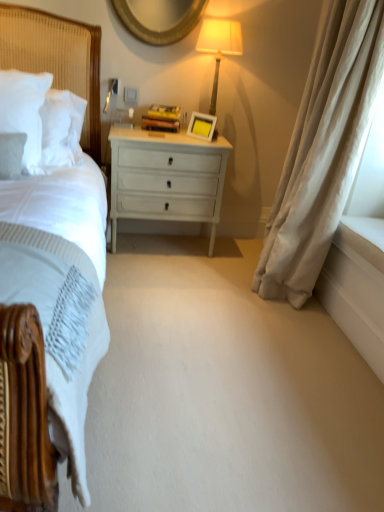
This screenshot has width=384, height=512. What do you see at coordinates (166, 178) in the screenshot?
I see `white glossy drawer at center` at bounding box center [166, 178].

What is the approximate height of yellow matte picture frame at center?

The height of yellow matte picture frame at center is 5.76 inches.

In order to face matte cream lampshade at upper right, should I rotate leftwards or rightwards?

You should look right and rotate roughly 3.415 degrees.

Locate an element on the screen. Image resolution: width=384 pixels, height=512 pixels. white textured headboard at left is located at coordinates (57, 59).

Is gold textured mirror at upper center beside yellow matte picture frame at center?

No, gold textured mirror at upper center is not next to yellow matte picture frame at center.

Which is behind, gold textured mirror at upper center or yellow matte picture frame at center?

yellow matte picture frame at center.

Considering the sizes of objects gold textured mirror at upper center and yellow matte picture frame at center in the image provided, who is wider, gold textured mirror at upper center or yellow matte picture frame at center?

gold textured mirror at upper center.

From a real-world perspective, which is physically above, gold textured mirror at upper center or yellow matte picture frame at center?

From a 3D spatial view, gold textured mirror at upper center is above.

Is white textured headboard at left at the left side of beige velvet curtain at right?

Correct, you'll find white textured headboard at left to the left of beige velvet curtain at right.

From the picture: Which object is more forward, white textured headboard at left or beige velvet curtain at right?

beige velvet curtain at right is in front.

Between white textured headboard at left and beige velvet curtain at right, which one has less height?

white textured headboard at left is shorter.

Identify the location of headboard that is above the beige velvet curtain at right (from a real-world perspective). This screenshot has width=384, height=512. (57, 59).

Locate an element on the screen. The height and width of the screenshot is (512, 384). pillow below the yellow matte picture frame at center (from the image's perspective) is located at coordinates (24, 111).

Is white soft pillow at left oriented towards yellow matte picture frame at center?

No, white soft pillow at left does not turn towards yellow matte picture frame at center.

Considering the positions of objects white soft pillow at left and yellow matte picture frame at center in the image provided, who is behind, white soft pillow at left or yellow matte picture frame at center?

yellow matte picture frame at center is behind.

Based on the photo, is white soft pillow at left shorter than yellow matte picture frame at center?

Incorrect, the height of white soft pillow at left does not fall short of that of yellow matte picture frame at center.

Is yellow matte picture frame at center looking in the opposite direction of matte cream lampshade at upper right?

Absolutely, yellow matte picture frame at center is directed away from matte cream lampshade at upper right.

From a real-world perspective, is yellow matte picture frame at center on top of matte cream lampshade at upper right?

Incorrect, from a real-world perspective, yellow matte picture frame at center is lower than matte cream lampshade at upper right.

Considering the positions of point (212, 135) and point (203, 22), is point (212, 135) closer or farther from the camera than point (203, 22)?

Point (212, 135).

Is point (196, 119) closer or farther from the camera than point (93, 117)?

Clearly, point (196, 119) is more distant from the camera than point (93, 117).

Would you say white textured headboard at left is part of yellow matte picture frame at center's contents?

Actually, white textured headboard at left is outside yellow matte picture frame at center.

Which object is positioned more to the left, yellow matte picture frame at center or white textured headboard at left?

Positioned to the left is white textured headboard at left.

This screenshot has height=512, width=384. What are the coordinates of `pillow located in front of the white textured headboard at left` in the screenshot? It's located at (24, 111).

From the image's perspective, is white soft pillow at left located above or below white textured headboard at left?

white soft pillow at left is below white textured headboard at left.

Can you confirm if white soft pillow at left is bigger than white textured headboard at left?

Incorrect, white soft pillow at left is not larger than white textured headboard at left.

From the picture: Is beige velvet curtain at right taller than yellow matte picture frame at center?

Indeed, beige velvet curtain at right has a greater height compared to yellow matte picture frame at center.

Which object is wider, beige velvet curtain at right or yellow matte picture frame at center?

beige velvet curtain at right.

Is beige velvet curtain at right with yellow matte picture frame at center?

beige velvet curtain at right and yellow matte picture frame at center are clearly separated.

This screenshot has height=512, width=384. I want to click on picture frame below the gold textured mirror at upper center (from the image's perspective), so click(x=202, y=126).

Locate an element on the screen. curtain in front of the white textured headboard at left is located at coordinates (323, 148).

Based on their spatial positions, is gold textured mirror at upper center or beige velvet curtain at right further from yellow matte picture frame at center?

beige velvet curtain at right lies further to yellow matte picture frame at center than the other object.

From the picture: Considering their positions, is matte cream lampshade at upper right positioned further to white glossy drawer at center than white soft pillow at left?

white soft pillow at left.

Which object lies further to the anchor point white textured headboard at left, yellow matte picture frame at center or white soft pillow at left?

yellow matte picture frame at center.

Looking at the image, which one is located closer to beige velvet curtain at right, matte cream lampshade at upper right or white textured headboard at left?

Based on the image, matte cream lampshade at upper right appears to be nearer to beige velvet curtain at right.

When comparing their distances from yellow matte picture frame at center, does matte cream lampshade at upper right or gold textured mirror at upper center seem closer?

matte cream lampshade at upper right lies closer to yellow matte picture frame at center than the other object.

From the image, which object appears to be farther from matte cream lampshade at upper right, white textured headboard at left or beige velvet curtain at right?

beige velvet curtain at right is further to matte cream lampshade at upper right.

Estimate the real-world distances between objects in this image. Which object is closer to beige velvet curtain at right, white textured headboard at left or gold textured mirror at upper center?

Based on the image, gold textured mirror at upper center appears to be nearer to beige velvet curtain at right.

Which object lies further to the anchor point white glossy drawer at center, white textured headboard at left or white soft pillow at left?

white soft pillow at left lies further to white glossy drawer at center than the other object.

Locate an element on the screen. This screenshot has height=512, width=384. bedside lamp that lies between gold textured mirror at upper center and yellow matte picture frame at center from top to bottom is located at coordinates (219, 46).

You are a GUI agent. You are given a task and a screenshot of the screen. Output one action in this format:
    pyautogui.click(x=<x>, y=<y>)
    Task: Click on the nightstand between white soft pillow at left and yellow matte picture frame at center from left to right
    The height and width of the screenshot is (512, 384).
    Given the screenshot: What is the action you would take?
    pyautogui.click(x=166, y=178)

Identify the location of picture frame between matte cream lampshade at upper right and white glossy drawer at center in the vertical direction. (202, 126).

At what (x,y) coordinates should I click in order to perform the action: click on nightstand between white textured headboard at left and matte cream lampshade at upper right. Please return your answer as a coordinate pair (x, y). The height and width of the screenshot is (512, 384). Looking at the image, I should click on (166, 178).